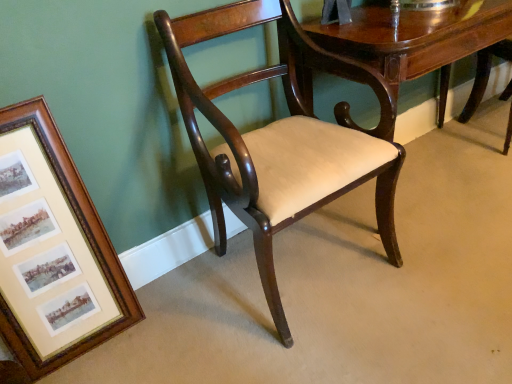
Where is `vacant area located to the right-hand side of mahogany wood chair at center`? vacant area located to the right-hand side of mahogany wood chair at center is located at coordinates (450, 264).